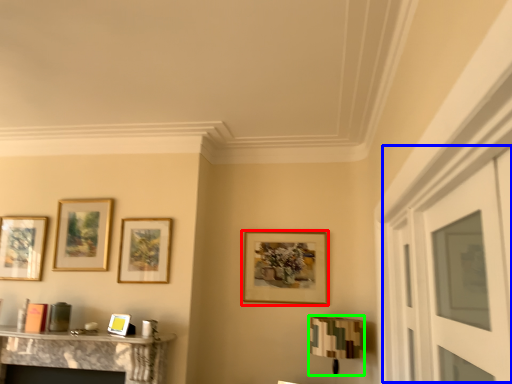
Question: Which is farther away from picture frame (highlighted by a red box)? glass door (highlighted by a blue box) or lamp (highlighted by a green box)?

Choices:
 (A) glass door
 (B) lamp

Answer: (A)